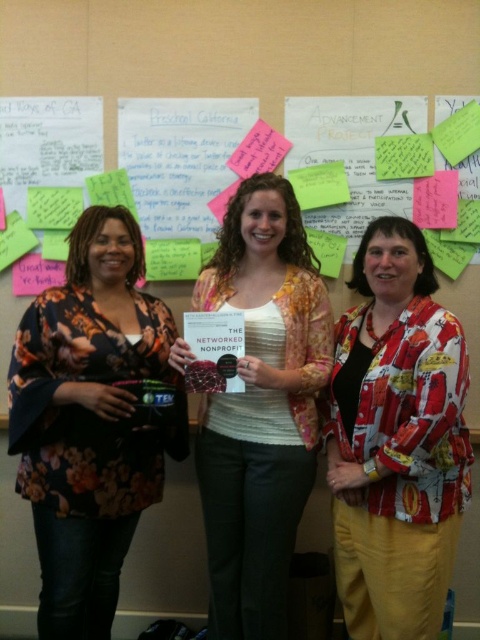
Can you confirm if floral kimono at left is positioned below printed fabric blouse at center?

Actually, floral kimono at left is above printed fabric blouse at center.

What do you see at coordinates (90, 419) in the screenshot? I see `floral kimono at left` at bounding box center [90, 419].

Who is more forward, (48, 474) or (373, 384)?

Point (373, 384)

Identify the location of floral kimono at left. The width and height of the screenshot is (480, 640). (90, 419).

Based on the photo, between printed fabric blouse at center and floral fabric blouse at center, which one appears on the right side from the viewer's perspective?

printed fabric blouse at center

Which is more to the left, printed fabric blouse at center or floral fabric blouse at center?

floral fabric blouse at center is more to the left.

Identify the location of printed fabric blouse at center. The width and height of the screenshot is (480, 640). (396, 440).

Is floral kimono at left closer to the viewer compared to floral fabric blouse at center?

Yes, it is in front of floral fabric blouse at center.

Looking at this image, does floral kimono at left have a lesser height compared to floral fabric blouse at center?

Yes, floral kimono at left is shorter than floral fabric blouse at center.

Which is in front, point (36, 316) or point (276, 236)?

Point (36, 316)

Identify the location of floral kimono at left. This screenshot has width=480, height=640. (90, 419).